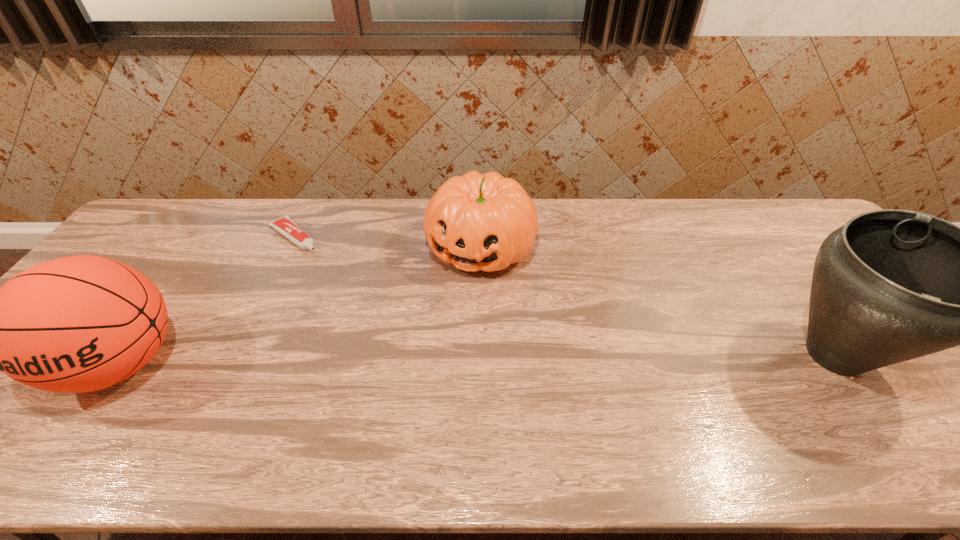
The image size is (960, 540). Find the location of `free space located 0.050m at the nozzle of the shortest object`. free space located 0.050m at the nozzle of the shortest object is located at coordinates (320, 257).

This screenshot has width=960, height=540. Find the location of `vacant area located 0.260m at the nozzle of the shortest object`. vacant area located 0.260m at the nozzle of the shortest object is located at coordinates (360, 291).

The image size is (960, 540). Identify the location of free location located 0.360m at the nozzle of the shortest object. (382, 309).

In order to click on pumpkin that is at the far edge in this screenshot , I will do `click(486, 222)`.

Identify the location of toothpaste situated at the far edge. pyautogui.click(x=287, y=227).

Where is `basketball present at the near edge`? basketball present at the near edge is located at coordinates (76, 324).

Find the location of a particular element. urn located at the near edge is located at coordinates (891, 285).

Locate an element on the screen. The width and height of the screenshot is (960, 540). object that is at the left edge is located at coordinates (76, 324).

Find the location of a particular element. This screenshot has height=540, width=960. object located in the right edge section of the desktop is located at coordinates (891, 285).

Locate an element on the screen. object that is at the near left corner is located at coordinates (76, 324).